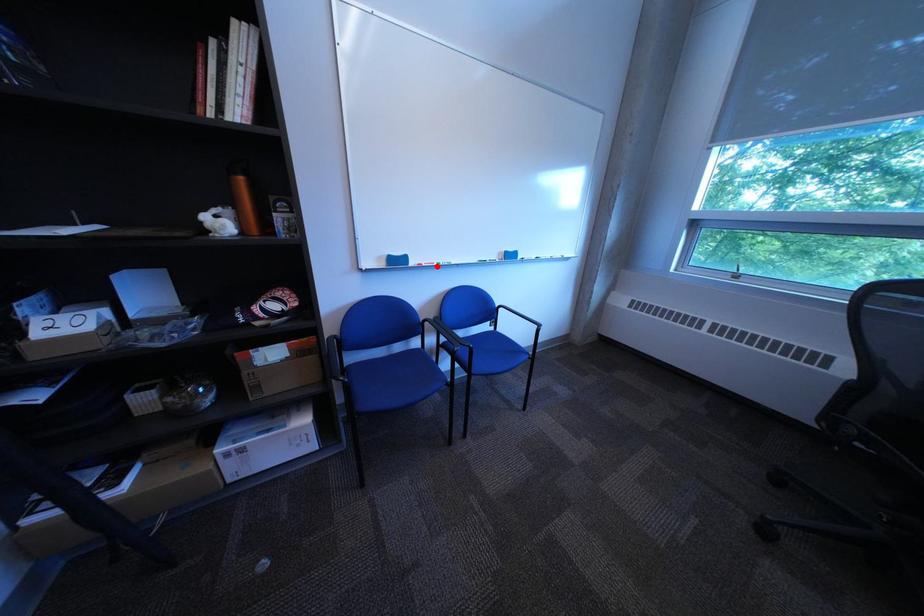
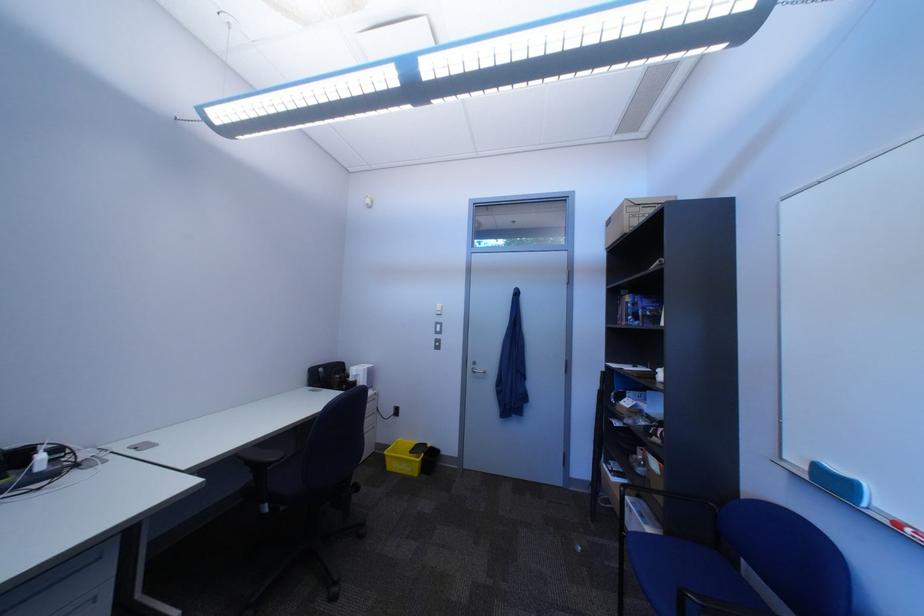
The point at the highlighted location is marked in the first image. Where is the corresponding point in the second image?

(915, 527)